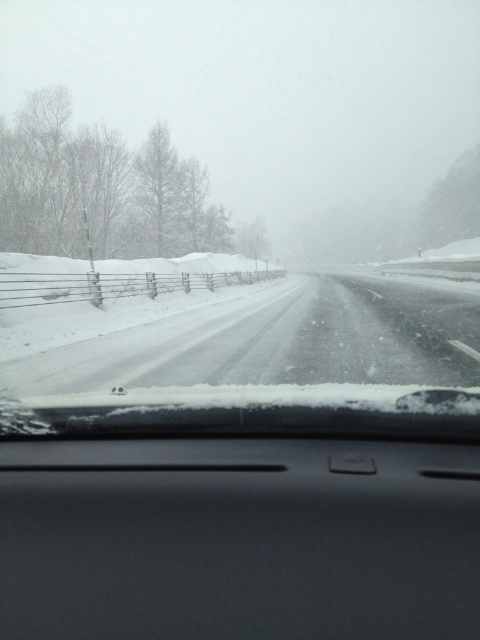
Question: From the image, what is the correct spatial relationship of black matte dashboard at center in relation to snowy asphalt highway at center?

Choices:
 (A) above
 (B) below

Answer: (B)

Question: Is black matte dashboard at center bigger than snowy asphalt highway at center?

Choices:
 (A) no
 (B) yes

Answer: (A)

Question: Among these points, which one is nearest to the camera?

Choices:
 (A) (226, 353)
 (B) (362, 456)

Answer: (B)

Question: Is the position of black matte dashboard at center more distant than that of snowy asphalt highway at center?

Choices:
 (A) no
 (B) yes

Answer: (A)

Question: Among these objects, which one is farthest from the camera?

Choices:
 (A) snowy asphalt highway at center
 (B) black matte dashboard at center

Answer: (A)

Question: Among these points, which one is farthest from the camera?

Choices:
 (A) (122, 371)
 (B) (166, 513)

Answer: (A)